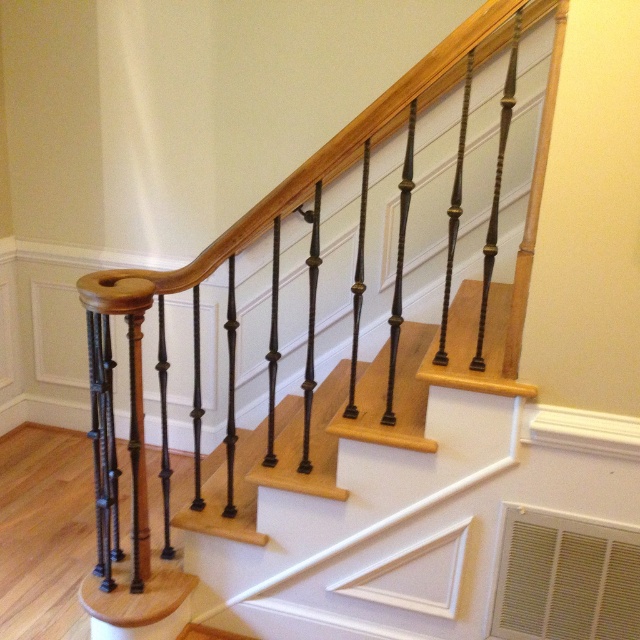
Is point (348, 451) positioned after point (472, 310)?

No, it is not.

Describe the element at coordinates (336, 369) in the screenshot. The image size is (640, 640). I see `black wrought iron railing at upper center` at that location.

Locate an element on the screen. This screenshot has width=640, height=640. black wrought iron railing at upper center is located at coordinates (336, 369).